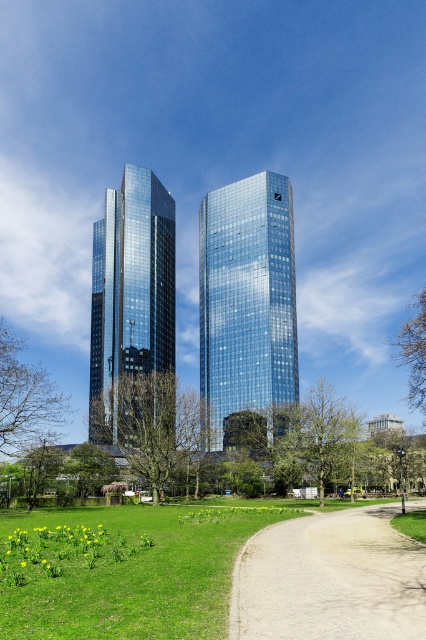
Identify the location of glossy glass skyscraper at center. (247, 300).

From the picture: Which is more to the right, glossy glass skyscraper at center or gravel path at center?

Positioned to the right is glossy glass skyscraper at center.

Between point (212, 416) and point (238, 604), which one is positioned in front?

Point (238, 604) is more forward.

Where is `glossy glass skyscraper at center`? glossy glass skyscraper at center is located at coordinates (247, 300).

In the scene shown: Does gravel path at center appear on the right side of green leafy tree at lower left?

Indeed, gravel path at center is positioned on the right side of green leafy tree at lower left.

The height and width of the screenshot is (640, 426). What are the coordinates of `gravel path at center` in the screenshot? It's located at (330, 579).

Identify the location of gravel path at center. The width and height of the screenshot is (426, 640). (330, 579).

Is green leafy tree at center smaller than green leafy tree at left?

No.

Who is more forward, (140, 456) or (25, 365)?

Positioned in front is point (25, 365).

Find the location of a particular element. The image size is (426, 640). green leafy tree at center is located at coordinates (150, 422).